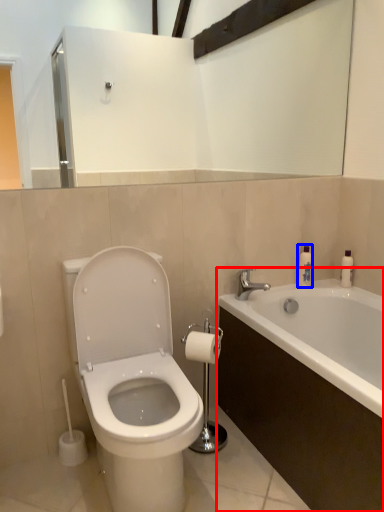
Question: Which object appears closest to the camera in this image, bathtub (highlighted by a red box) or soap dispenser (highlighted by a blue box)?

Choices:
 (A) bathtub
 (B) soap dispenser

Answer: (A)